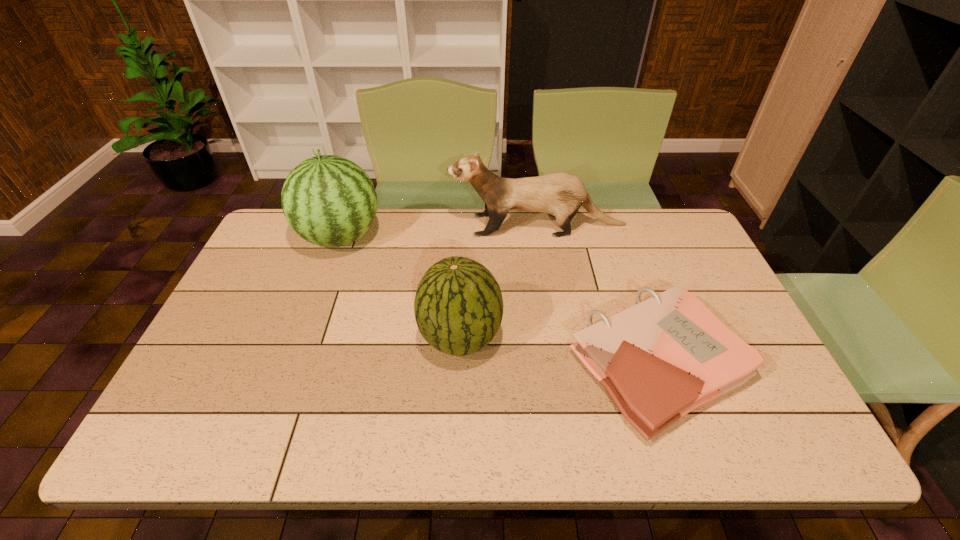
In the image, there is a desktop. Identify the location of vacant space at the left edge. (269, 281).

I want to click on free space at the right edge of the desktop, so click(676, 273).

Identify the location of free region at the far left corner. This screenshot has height=540, width=960. (300, 239).

In the image, there is a desktop. In order to click on vacant space at the far right corner in this screenshot , I will do `click(689, 250)`.

Image resolution: width=960 pixels, height=540 pixels. I want to click on vacant area between the ferret and the leftmost object, so click(x=439, y=232).

Find the location of a particular element. The height and width of the screenshot is (540, 960). free space between the right watermelon and the shortest object is located at coordinates (560, 352).

This screenshot has width=960, height=540. In order to click on vacant area that lies between the right watermelon and the ferret in this screenshot , I will do `click(499, 282)`.

The height and width of the screenshot is (540, 960). Identify the location of vacant point located between the ferret and the shorter watermelon. (499, 282).

I want to click on unoccupied position between the farther watermelon and the shorter watermelon, so click(400, 288).

In order to click on unoccupied area between the left watermelon and the ferret in this screenshot , I will do `click(439, 232)`.